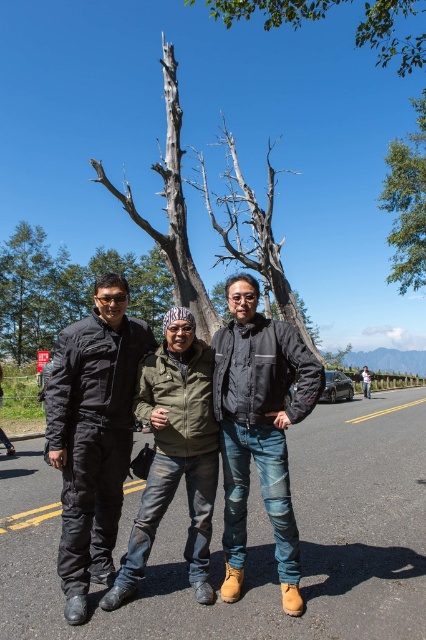
Question: Does green leafy tree at upper center come in front of denim jacket at center?

Choices:
 (A) no
 (B) yes

Answer: (B)

Question: Among these points, which one is nearest to the camera?

Choices:
 (A) (143, 392)
 (B) (391, 20)

Answer: (A)

Question: Can you confirm if charcoal textured trunk at center is wider than denim jacket at center?

Choices:
 (A) no
 (B) yes

Answer: (B)

Question: Can you confirm if black leather jacket at center is positioned below denim jacket at center?

Choices:
 (A) no
 (B) yes

Answer: (A)

Question: Which object is farther from the camera taking this photo?

Choices:
 (A) charcoal textured trunk at center
 (B) green leafy tree at upper right
 (C) denim jacket at center

Answer: (B)

Question: Based on their relative distances, which object is nearer to the green leafy tree at upper center?

Choices:
 (A) denim jacket at center
 (B) green leafy tree at upper right
 (C) black leather jacket at center

Answer: (B)